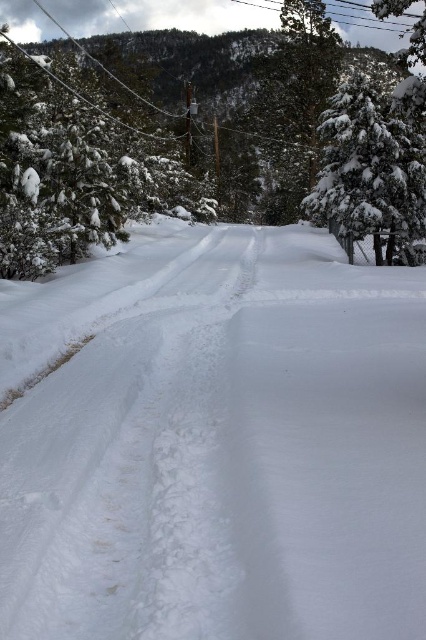
Is white snow ski slope at center bigger than snow-covered evergreen tree at center?

Incorrect, white snow ski slope at center is not larger than snow-covered evergreen tree at center.

Who is positioned more to the right, white snow ski slope at center or snow-covered evergreen tree at center?

From the viewer's perspective, white snow ski slope at center appears more on the right side.

Is point (236, 529) positioned before point (290, 1)?

Yes, it is.

Locate an element on the screen. This screenshot has height=640, width=426. white snow ski slope at center is located at coordinates (213, 442).

Measure the distance from white snow ski slope at center to white snow-covered tree at right.

white snow ski slope at center is 6.95 meters away from white snow-covered tree at right.

Locate an element on the screen. white snow ski slope at center is located at coordinates (213, 442).

Image resolution: width=426 pixels, height=640 pixels. In order to click on white snow ski slope at center in this screenshot , I will do `click(213, 442)`.

Is snow-covered evergreen tree at center thinner than white snow-covered tree at right?

No.

Where is `snow-covered evergreen tree at center`? The width and height of the screenshot is (426, 640). snow-covered evergreen tree at center is located at coordinates (322, 141).

Locate an element on the screen. The width and height of the screenshot is (426, 640). snow-covered evergreen tree at center is located at coordinates (322, 141).